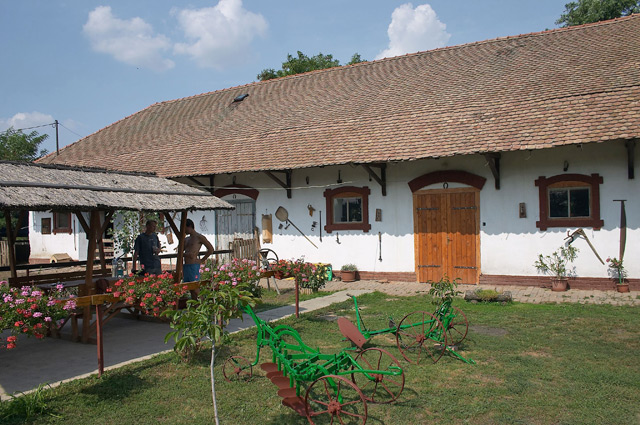
Find the location of a particular element. The width and height of the screenshot is (640, 425). doors is located at coordinates (458, 233), (433, 234).